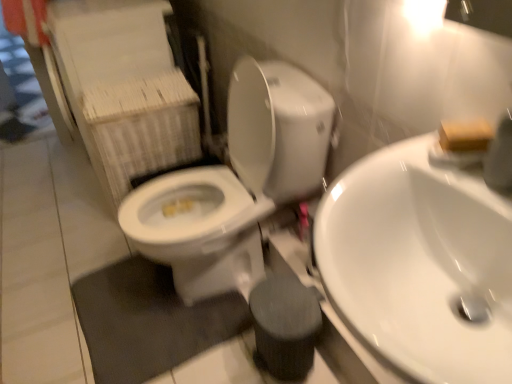
Question: Considering the relative positions of white glossy sink at center right and white glossy toilet at center in the image provided, is white glossy sink at center right to the left or to the right of white glossy toilet at center?

Choices:
 (A) left
 (B) right

Answer: (B)

Question: Considering the positions of white glossy sink at center right and white glossy toilet at center in the image, is white glossy sink at center right bigger or smaller than white glossy toilet at center?

Choices:
 (A) small
 (B) big

Answer: (A)

Question: Which object is positioned farthest from the white glossy toilet at center?

Choices:
 (A) white glossy sink at center right
 (B) wooden block at upper right

Answer: (B)

Question: Estimate the real-world distances between objects in this image. Which object is farther from the wooden block at upper right?

Choices:
 (A) white glossy toilet at center
 (B) white glossy sink at center right

Answer: (A)